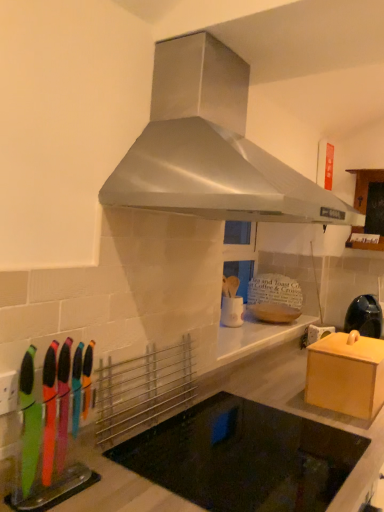
Question: Is wooden box at right, marked as the 1th cabinetry in a left-to-right arrangement, taller than stainless steel range hood at upper center?

Choices:
 (A) no
 (B) yes

Answer: (A)

Question: Is wooden box at right, the 1th cabinetry from the bottom, wider than stainless steel range hood at upper center?

Choices:
 (A) yes
 (B) no

Answer: (B)

Question: Can you confirm if wooden box at right, the 1th cabinetry from the bottom, is positioned to the right of stainless steel range hood at upper center?

Choices:
 (A) no
 (B) yes

Answer: (B)

Question: Considering the relative sizes of wooden box at right, the 2th cabinetry when ordered from back to front, and stainless steel range hood at upper center in the image provided, is wooden box at right, the 2th cabinetry when ordered from back to front, thinner than stainless steel range hood at upper center?

Choices:
 (A) no
 (B) yes

Answer: (B)

Question: From the image's perspective, does wooden box at right, the 1th cabinetry from the bottom, appear lower than stainless steel range hood at upper center?

Choices:
 (A) no
 (B) yes

Answer: (B)

Question: From a real-world perspective, is wooden box at right, the 2th cabinetry when ordered from back to front, located beneath stainless steel range hood at upper center?

Choices:
 (A) no
 (B) yes

Answer: (B)

Question: Considering the relative sizes of black glass cooktop at center and matte black kettle at right in the image provided, is black glass cooktop at center bigger than matte black kettle at right?

Choices:
 (A) no
 (B) yes

Answer: (B)

Question: Is black glass cooktop at center not close to matte black kettle at right?

Choices:
 (A) no
 (B) yes

Answer: (B)

Question: Is black glass cooktop at center thinner than matte black kettle at right?

Choices:
 (A) no
 (B) yes

Answer: (A)

Question: From a real-world perspective, is black glass cooktop at center on matte black kettle at right?

Choices:
 (A) yes
 (B) no

Answer: (B)

Question: Does black glass cooktop at center have a lesser height compared to matte black kettle at right?

Choices:
 (A) yes
 (B) no

Answer: (B)

Question: Can you confirm if black glass cooktop at center is wider than matte black kettle at right?

Choices:
 (A) yes
 (B) no

Answer: (A)

Question: Does wooden cabinet at upper right, which is counted as the second cabinetry, starting from the left, have a lesser height compared to matte black kettle at right?

Choices:
 (A) yes
 (B) no

Answer: (B)